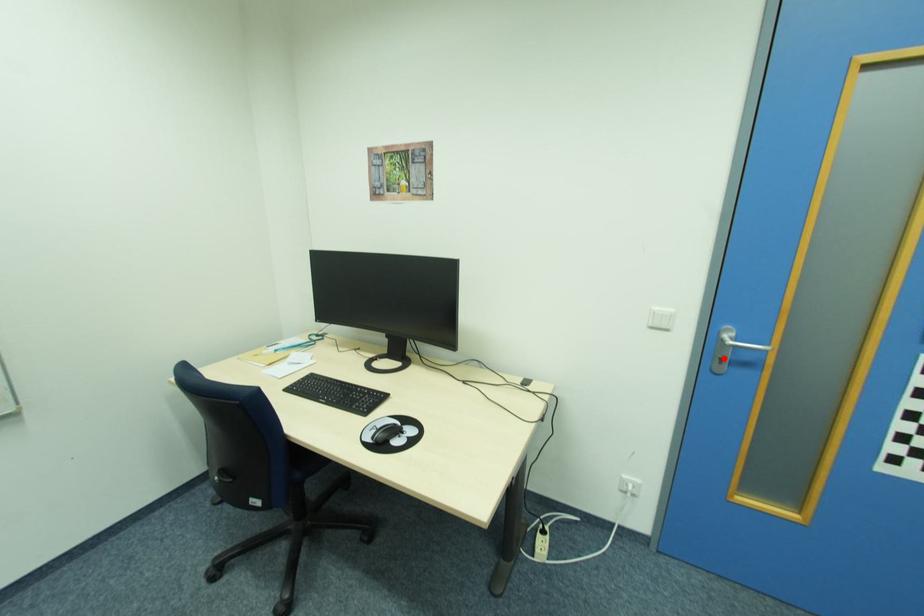
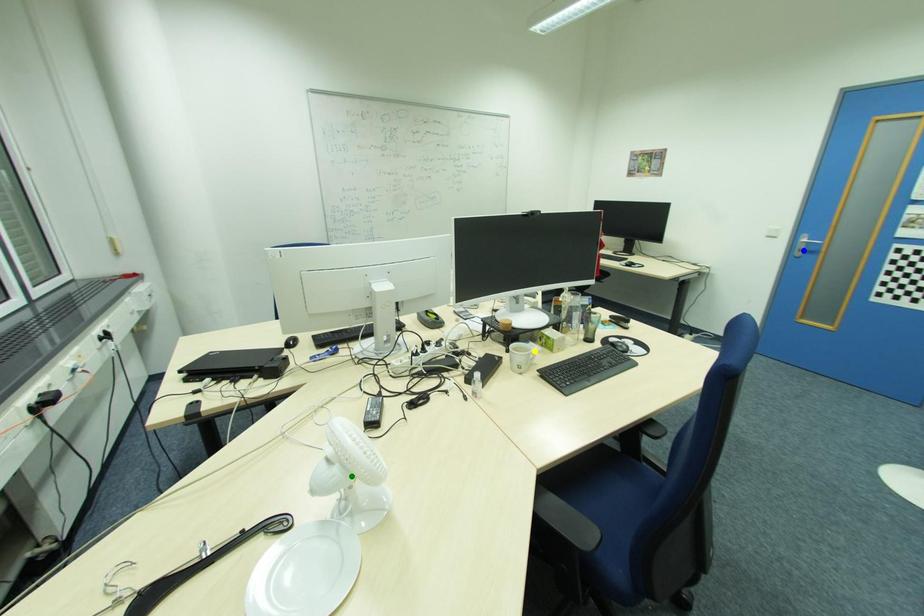
Question: I am providing you with two images of the same scene from different viewpoints. A red point is marked on the first image. You are given multiple points on the second image. In image 2, which mark is for the same physical point as the one in image 1?

Choices:
 (A) green point
 (B) yellow point
 (C) blue point

Answer: (C)